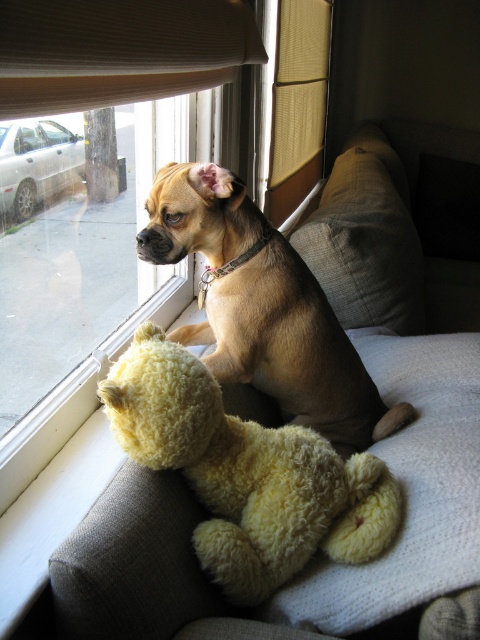
Question: Is soft beige couch at center smaller than clear glass window at upper left?

Choices:
 (A) no
 (B) yes

Answer: (A)

Question: Can you confirm if soft beige couch at center is positioned below light brown fur at center?

Choices:
 (A) yes
 (B) no

Answer: (B)

Question: Which object is farther from the camera taking this photo?

Choices:
 (A) yellow fuzzy teddy bear at lower center
 (B) light brown fur at center

Answer: (B)

Question: Among these objects, which one is farthest from the camera?

Choices:
 (A) yellow fuzzy teddy bear at lower center
 (B) soft beige couch at center

Answer: (A)

Question: Which point is farther from the camera taking this photo?

Choices:
 (A) (285, 339)
 (B) (391, 442)

Answer: (B)

Question: Can you confirm if yellow fuzzy teddy bear at lower center is bigger than clear glass window at upper left?

Choices:
 (A) yes
 (B) no

Answer: (B)